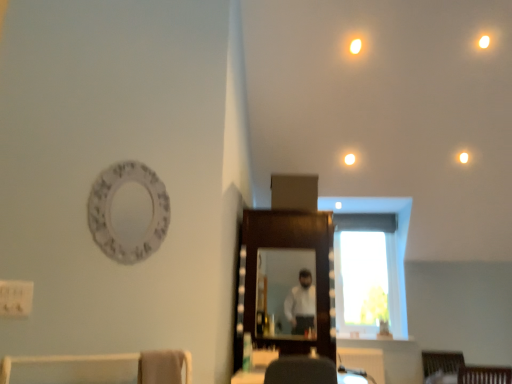
Question: Considering the relative sizes of white glossy light at upper center and white glossy light at upper center, the second lighting when ordered from back to front, in the image provided, is white glossy light at upper center wider than white glossy light at upper center, the second lighting when ordered from back to front,?

Choices:
 (A) yes
 (B) no

Answer: (A)

Question: Considering the relative positions of white glossy light at upper center and white glossy light at upper center, acting as the 1th lighting starting from the top, in the image provided, is white glossy light at upper center to the left of white glossy light at upper center, acting as the 1th lighting starting from the top, from the viewer's perspective?

Choices:
 (A) no
 (B) yes

Answer: (A)

Question: Can you confirm if white glossy light at upper center is shorter than white glossy light at upper center, marked as the 1th lighting in a front-to-back arrangement?

Choices:
 (A) yes
 (B) no

Answer: (A)

Question: Does white glossy light at upper center appear on the right side of white glossy light at upper center, acting as the 1th lighting starting from the top?

Choices:
 (A) no
 (B) yes

Answer: (B)

Question: Is the depth of white glossy light at upper center less than that of white glossy light at upper center, marked as the 1th lighting in a front-to-back arrangement?

Choices:
 (A) no
 (B) yes

Answer: (A)

Question: Visually, is white glossy light at upper center positioned to the left or to the right of warm matte light bulb at upper right, the 1th lighting positioned from the bottom?

Choices:
 (A) left
 (B) right

Answer: (A)

Question: From a real-world perspective, is white glossy light at upper center positioned above or below warm matte light bulb at upper right, positioned as the 2th lighting in top-to-bottom order?

Choices:
 (A) above
 (B) below

Answer: (B)

Question: From the image's perspective, is white glossy light at upper center positioned above or below warm matte light bulb at upper right, positioned as the 2th lighting in top-to-bottom order?

Choices:
 (A) below
 (B) above

Answer: (A)

Question: Based on their sizes in the image, would you say white glossy light at upper center is bigger or smaller than warm matte light bulb at upper right, the 1th lighting positioned from the bottom?

Choices:
 (A) big
 (B) small

Answer: (A)

Question: Is white glossy light at upper center, the second lighting from the bottom, bigger or smaller than white glossy light at upper center?

Choices:
 (A) big
 (B) small

Answer: (A)

Question: From a real-world perspective, is white glossy light at upper center, the second lighting from the bottom, physically located above or below white glossy light at upper center?

Choices:
 (A) below
 (B) above

Answer: (B)

Question: In terms of width, does white glossy light at upper center, acting as the 1th lighting starting from the top, look wider or thinner when compared to white glossy light at upper center?

Choices:
 (A) thin
 (B) wide

Answer: (A)

Question: Is point (350, 46) closer or farther from the camera than point (351, 160)?

Choices:
 (A) closer
 (B) farther

Answer: (A)

Question: In terms of width, does matte wooden mirror at center, the 1th mirror positioned from the back, look wider or thinner when compared to white glossy light at upper center?

Choices:
 (A) wide
 (B) thin

Answer: (B)

Question: From a real-world perspective, relative to white glossy light at upper center, is matte wooden mirror at center, the 1th mirror positioned from the back, vertically above or below?

Choices:
 (A) above
 (B) below

Answer: (B)